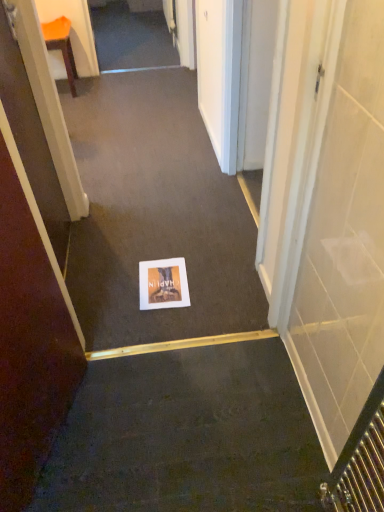
Where is `vacant area on top of matte paper postcard at center (from a real-world perspective)`? Image resolution: width=384 pixels, height=512 pixels. vacant area on top of matte paper postcard at center (from a real-world perspective) is located at coordinates (162, 284).